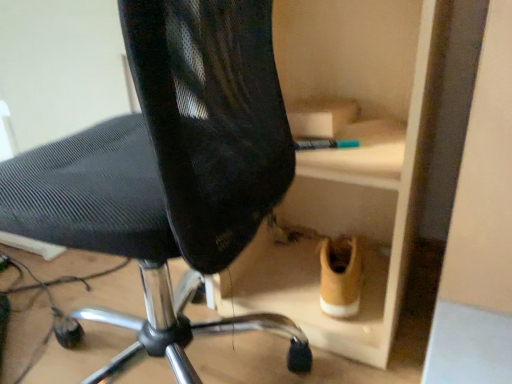
Question: Relative to black mesh chair at center, is tan suede sneaker at lower right in front or behind?

Choices:
 (A) behind
 (B) front

Answer: (A)

Question: Is tan suede sneaker at lower right bigger or smaller than black mesh chair at center?

Choices:
 (A) big
 (B) small

Answer: (B)

Question: Is tan suede sneaker at lower right wider or thinner than black mesh chair at center?

Choices:
 (A) wide
 (B) thin

Answer: (B)

Question: Is black mesh chair at center in front of or behind tan suede sneaker at lower right in the image?

Choices:
 (A) behind
 (B) front

Answer: (B)

Question: Is black mesh chair at center to the left or to the right of tan suede sneaker at lower right in the image?

Choices:
 (A) right
 (B) left

Answer: (B)

Question: From the image's perspective, is black mesh chair at center positioned above or below tan suede sneaker at lower right?

Choices:
 (A) above
 (B) below

Answer: (A)

Question: In terms of size, does black mesh chair at center appear bigger or smaller than tan suede sneaker at lower right?

Choices:
 (A) big
 (B) small

Answer: (A)